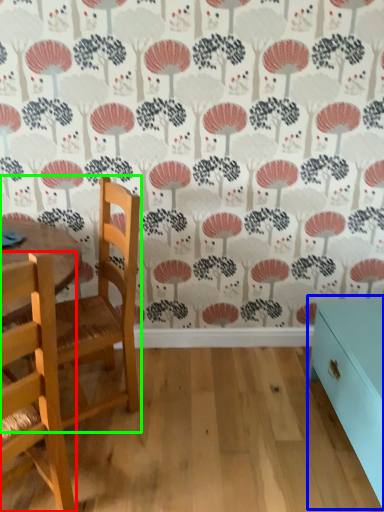
Question: Based on their relative distances, which object is nearer to chair (highlighted by a red box)? Choose from table (highlighted by a blue box) and chair (highlighted by a green box).

Choices:
 (A) table
 (B) chair

Answer: (B)